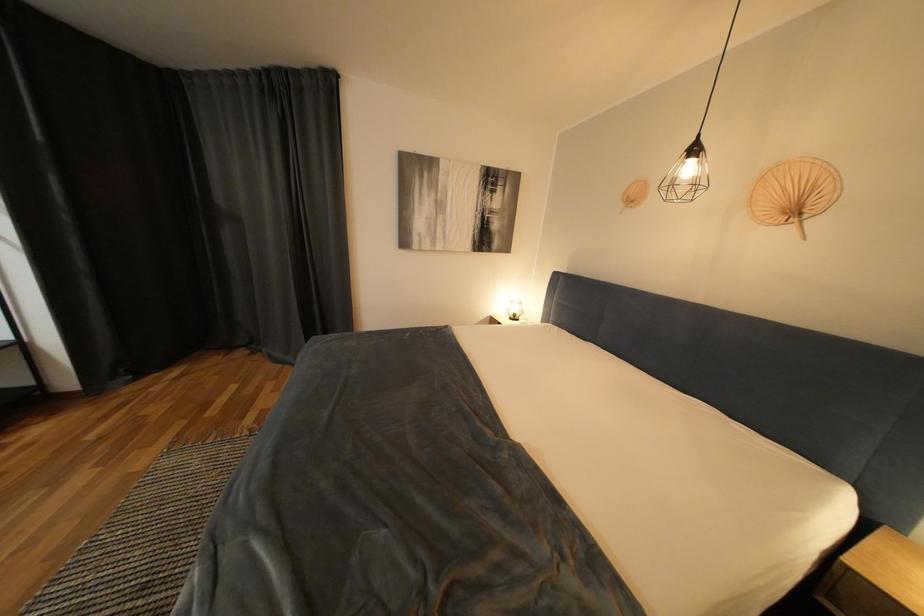
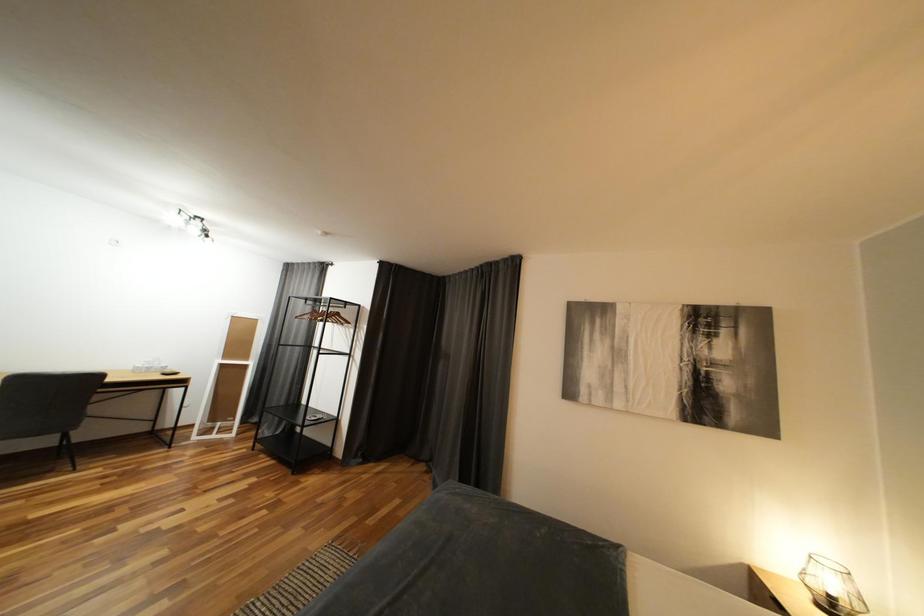
Based on the continuous images, in which direction is the camera rotating?

The camera's rotation is toward left-up.